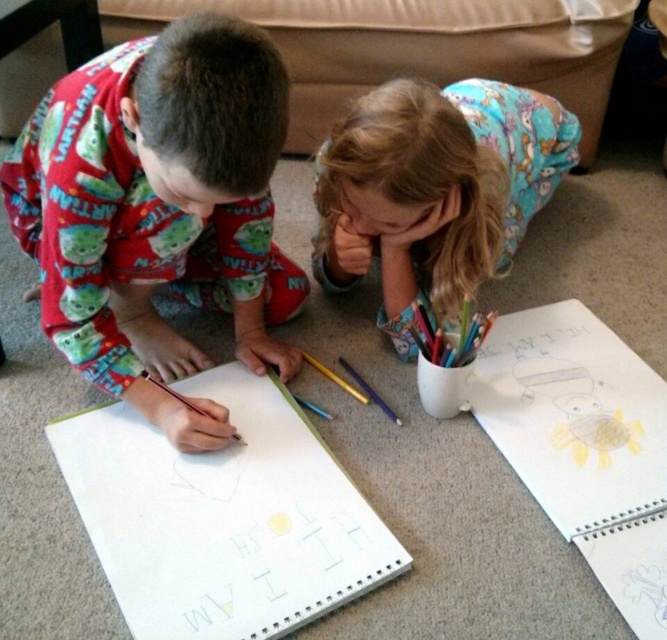
Question: Is white paper at center below matte yellow crayon at center?

Choices:
 (A) yes
 (B) no

Answer: (A)

Question: Which of the following is the farthest from the observer?

Choices:
 (A) (366, 204)
 (B) (201, 593)
 (C) (334, 381)
 (D) (9, 216)

Answer: (C)

Question: From the image, what is the correct spatial relationship of red cotton pajamas at left in relation to white paper at center?

Choices:
 (A) below
 (B) above

Answer: (B)

Question: Which object is the closest to the matte yellow crayon at center?

Choices:
 (A) red cotton pajamas at left
 (B) fluffy blue pajamas at center
 (C) white paper at center

Answer: (C)

Question: Which point is closer to the camera?

Choices:
 (A) red cotton pajamas at left
 (B) white paper at center

Answer: (A)

Question: From the image, what is the correct spatial relationship of red cotton pajamas at left in relation to matte yellow crayon at center?

Choices:
 (A) below
 (B) above

Answer: (B)